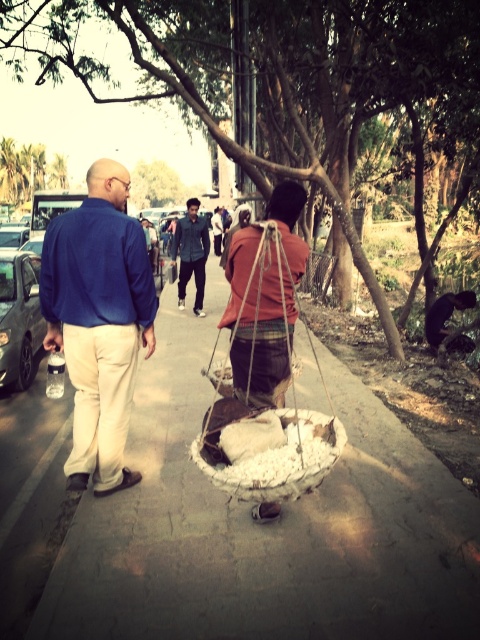
Does point (60, 548) come closer to viewer compared to point (91, 417)?

That is True.

Which is more to the right, concrete sidewalk at center or matte blue shirt at center?

Positioned to the right is concrete sidewalk at center.

What do you see at coordinates (232, 524) in the screenshot? The height and width of the screenshot is (640, 480). I see `concrete sidewalk at center` at bounding box center [232, 524].

You are a GUI agent. You are given a task and a screenshot of the screen. Output one action in this format:
    pyautogui.click(x=<x>, y=<y>)
    Task: Click on the concrete sidewalk at center
    
    Given the screenshot: What is the action you would take?
    pyautogui.click(x=232, y=524)

Is matte blue shirt at center to the right of denim jacket at center from the viewer's perspective?

Correct, you'll find matte blue shirt at center to the right of denim jacket at center.

Can you confirm if matte blue shirt at center is positioned to the left of denim jacket at center?

In fact, matte blue shirt at center is to the right of denim jacket at center.

Who is more distant from viewer, [90,444] or [190,276]?

The point [190,276] is behind.

This screenshot has height=640, width=480. In order to click on matte blue shirt at center in this screenshot , I will do `click(98, 321)`.

Is concrete sidewalk at center below denim jacket at center?

Indeed, concrete sidewalk at center is positioned under denim jacket at center.

Which is more to the right, concrete sidewalk at center or denim jacket at center?

Positioned to the right is concrete sidewalk at center.

Between point (73, 540) and point (182, 282), which one is positioned in front?

Point (73, 540) is in front.

At what (x,y) coordinates should I click in order to perform the action: click on concrete sidewalk at center. Please return your answer as a coordinate pair (x, y). Looking at the image, I should click on (232, 524).